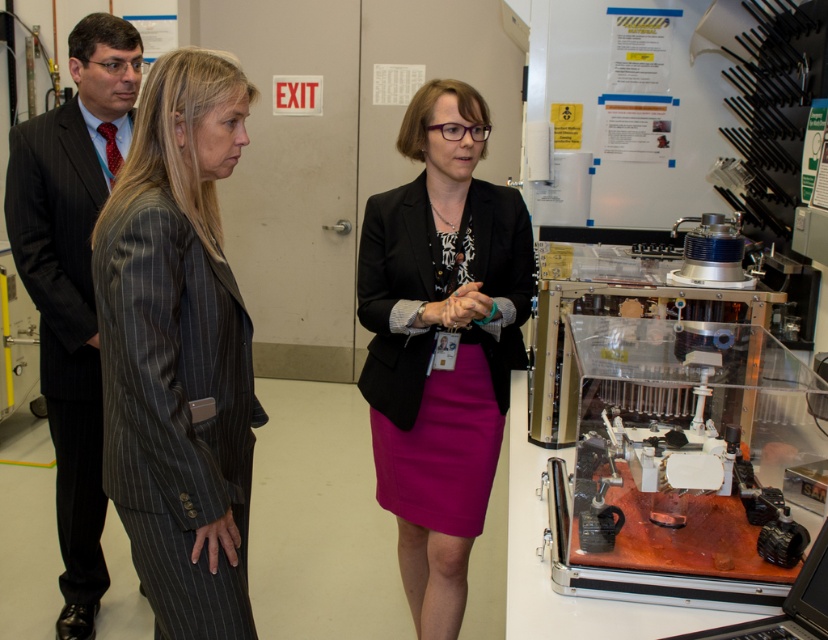
Looking at this image, you are a fashion designer observing the two garments in the center of the lab scene. The matte black blazer at center and the fuchsia fabric skirt at center are part of a new collection. If you need to place them on a mannequin for a photo shoot, will they fit together without overlapping?

The matte black blazer at center and the fuchsia fabric skirt at center are 3.43 inches apart in the image. Since this distance indicates their placement on the mannequin, they can be arranged without overlapping as they are separate garments designed to be worn together.

You are a safety inspector in this lab. You notice a point at coordinates point (179,352). What object is this point located on?

The point (179,352) is located on the gray pinstripe suit at left.

You are a security guard in the lab and need to check both the black pinstripe suit at left and the black plastic laptop at lower right. Which object should you check first based on their positions?

The black pinstripe suit at left should be checked first because it is closer to the security guard than the black plastic laptop at lower right.